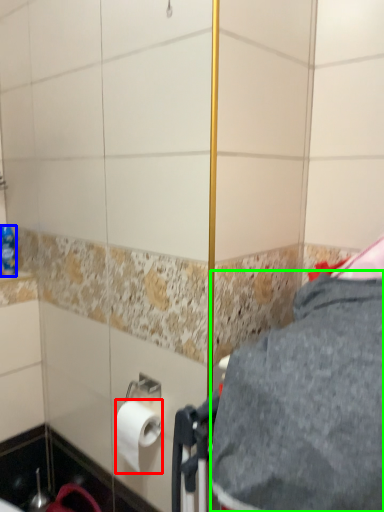
Question: Which object is positioned farthest from toilet paper (highlighted by a red box)? Select from bottle (highlighted by a blue box) and gray (highlighted by a green box).

Choices:
 (A) bottle
 (B) gray

Answer: (A)